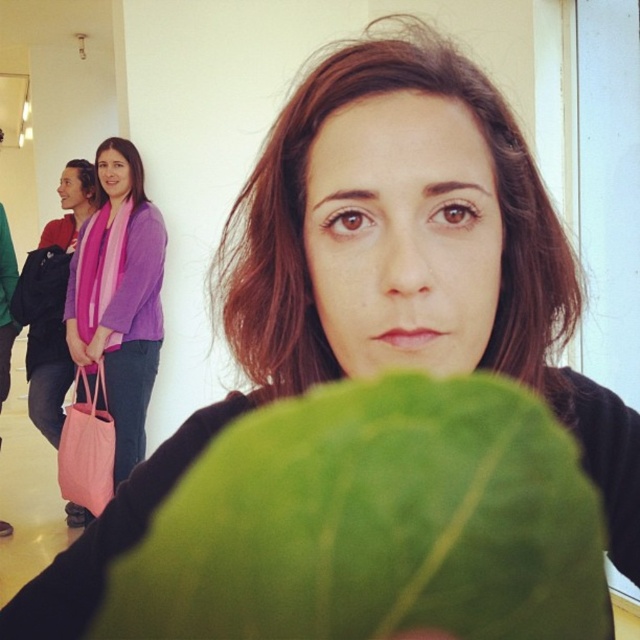
Between green matte leaf at center and pink fabric bag at left, which one is positioned lower?

green matte leaf at center is below.

Locate an element on the screen. green matte leaf at center is located at coordinates (374, 524).

Who is higher up, pink fabric scarf at upper left or pink fabric bag at left?

Positioned higher is pink fabric scarf at upper left.

Between point (144, 336) and point (8, 296), which one is positioned behind?

The point (8, 296) is more distant.

The image size is (640, 640). What are the coordinates of `pink fabric scarf at upper left` in the screenshot? It's located at (118, 298).

Does green matte leaf at center appear under pink fabric scarf at upper left?

Correct, green matte leaf at center is located below pink fabric scarf at upper left.

Can you confirm if green matte leaf at center is taller than pink fabric scarf at upper left?

Incorrect, green matte leaf at center's height is not larger of pink fabric scarf at upper left's.

What do you see at coordinates (374, 524) in the screenshot? I see `green matte leaf at center` at bounding box center [374, 524].

In order to click on green matte leaf at center in this screenshot , I will do tap(374, 524).